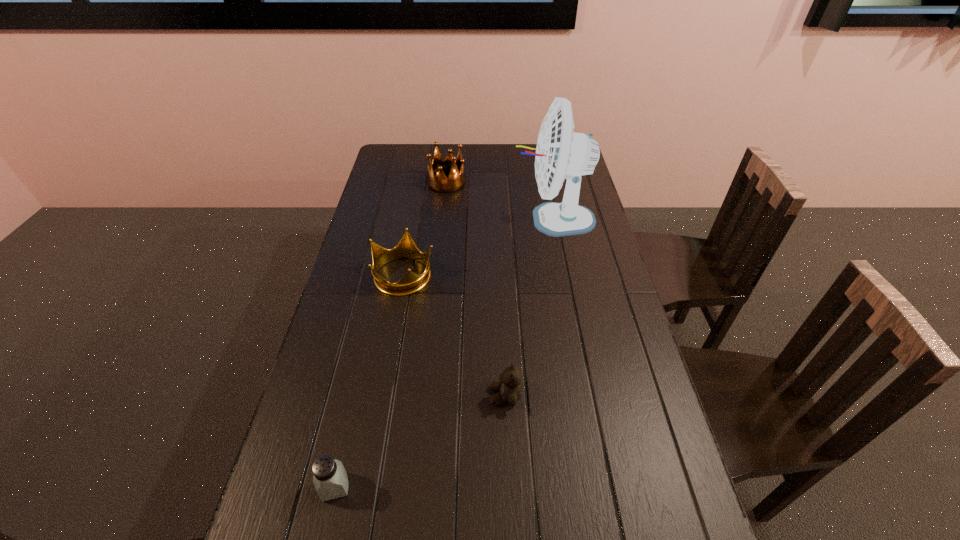
The width and height of the screenshot is (960, 540). I want to click on unoccupied position between the shorter crown and the nearest object, so click(x=370, y=381).

Find the location of `empty location between the nearest object and the tallest object`. empty location between the nearest object and the tallest object is located at coordinates (444, 353).

Locate an element on the screen. The width and height of the screenshot is (960, 540). free spot between the nearest object and the shorter crown is located at coordinates (370, 381).

Identify which object is the second closest to the tallest object. Please provide its 2D coordinates. Your answer should be formatted as a tuple, i.e. [(x, y)], where the tuple contains the x and y coordinates of a point satisfying the conditions above.

[(411, 282)]

Where is `object identified as the closest to the nearest object`? The width and height of the screenshot is (960, 540). object identified as the closest to the nearest object is located at coordinates (509, 387).